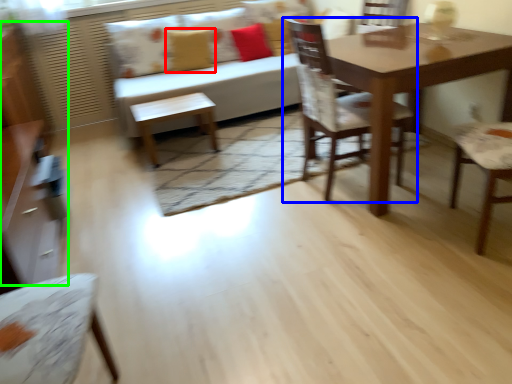
Question: Which object is positioned farthest from pillow (highlighted by a red box)? Select from chair (highlighted by a blue box) and dresser (highlighted by a green box).

Choices:
 (A) chair
 (B) dresser

Answer: (A)